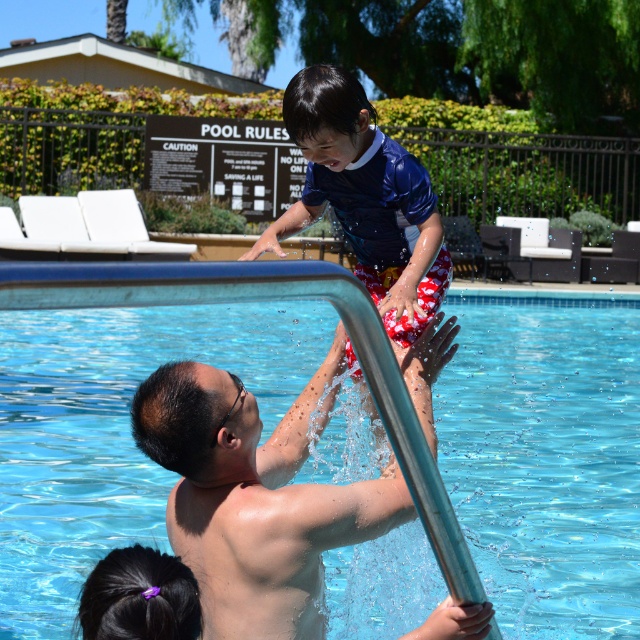
You are standing at the edge of the pool and want to place a floating toy in the clear blue water at center. According to the coordinates provided, where should you place the toy?

You should place the floating toy at the coordinates point (124, 403) where the clear blue water at center is located.

You are designing a swimming pool and want to ensure that the clear blue water at center and the purple hairband at lower left are visible from the poolside lounge area. Given their sizes, which object would appear larger in the distance?

The clear blue water at center would appear larger in the distance because its width is larger than the purple hairband at lower left.

Looking at this image, you are standing at point (147, 582) and want to walk to point (577, 429). Is the destination point behind you or in front of you?

The destination point (577, 429) is behind point (147, 582), so it is behind you.